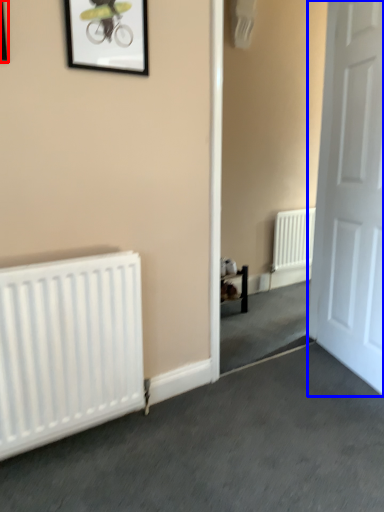
Question: Among these objects, which one is nearest to the camera, picture frame (highlighted by a red box) or door (highlighted by a blue box)?

Choices:
 (A) picture frame
 (B) door

Answer: (A)